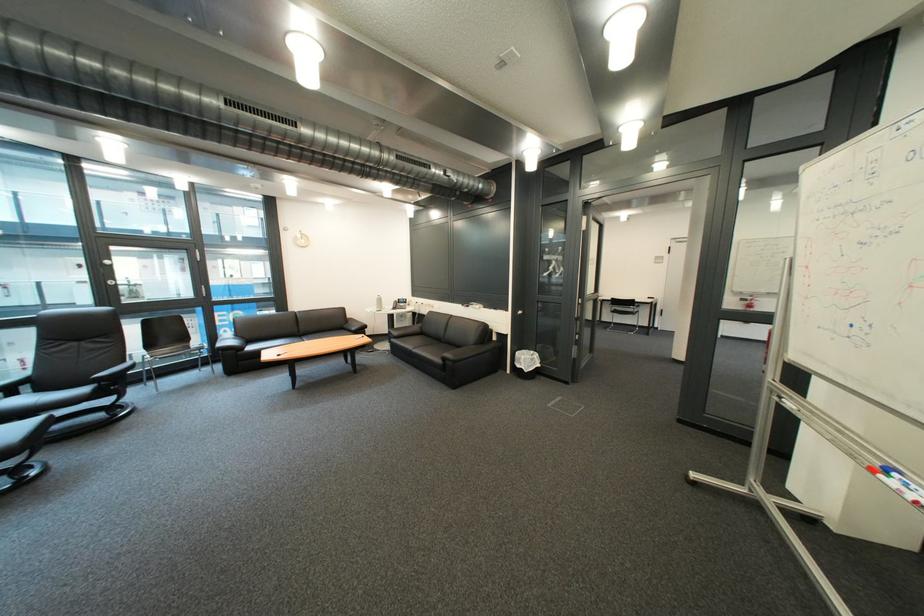
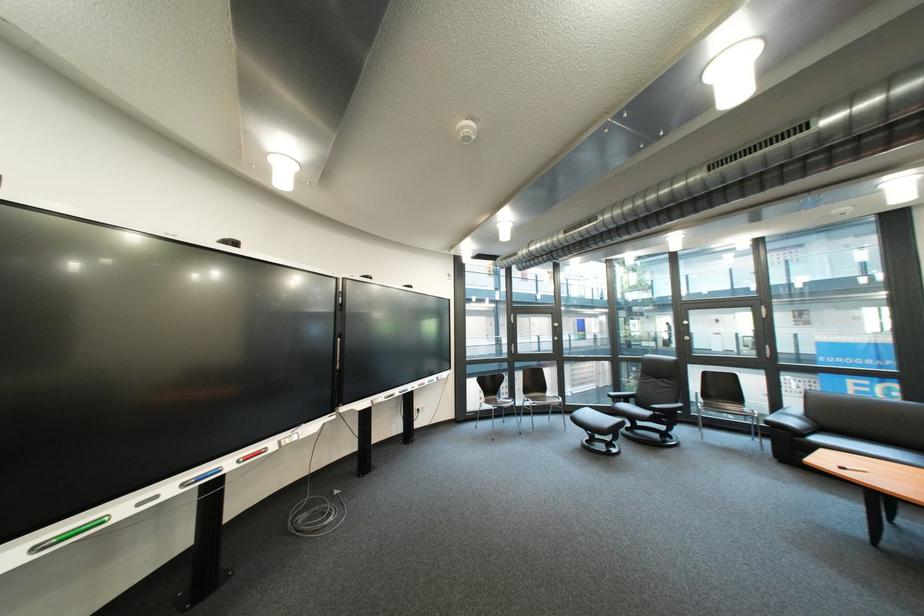
Locate, in the second image, the point that corresponds to [96,391] in the first image.

(661, 415)